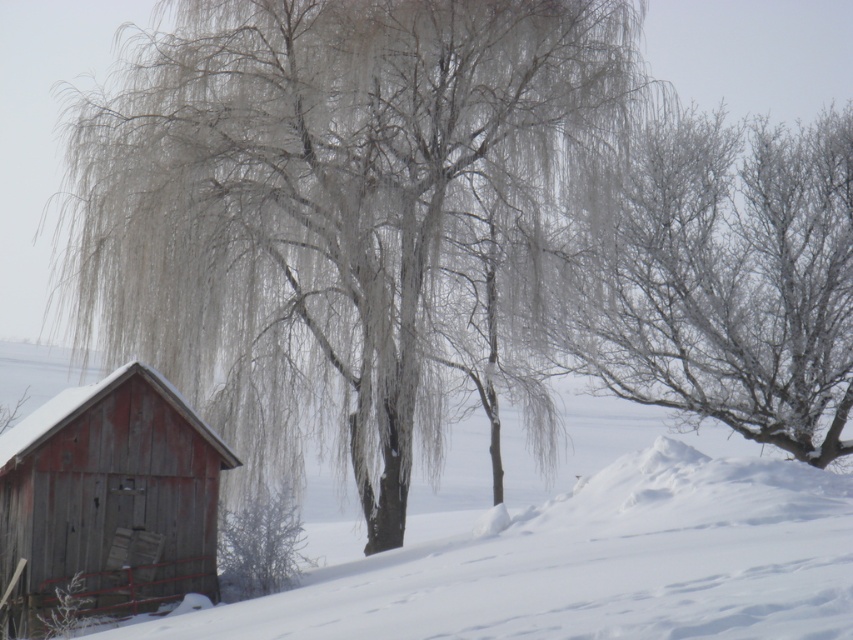
Which is above, frosted wood tree at left or rusty wood cabin at lower left?

frosted wood tree at left is higher up.

Which is in front, point (412, 218) or point (73, 476)?

Point (73, 476) is in front.

At what (x,y) coordinates should I click in order to perform the action: click on frosted wood tree at left. Please return your answer as a coordinate pair (x, y). Looking at the image, I should click on (335, 208).

Between frosted wood tree at left and frosted branches at center, which one has less height?

With less height is frosted branches at center.

Can you confirm if frosted wood tree at left is taller than frosted branches at center?

Yes, frosted wood tree at left is taller than frosted branches at center.

Is point (413, 316) farther from camera compared to point (769, 301)?

No, it is in front of (769, 301).

At what (x,y) coordinates should I click in order to perform the action: click on frosted wood tree at left. Please return your answer as a coordinate pair (x, y). The width and height of the screenshot is (853, 640). Looking at the image, I should click on (335, 208).

Who is positioned more to the right, white fluffy snow at lower left or frosted branches at center?

From the viewer's perspective, frosted branches at center appears more on the right side.

Who is shorter, white fluffy snow at lower left or frosted branches at center?

With less height is frosted branches at center.

Is point (624, 628) positioned in front of point (695, 298)?

Yes, it is in front of point (695, 298).

This screenshot has width=853, height=640. I want to click on white fluffy snow at lower left, so click(x=585, y=563).